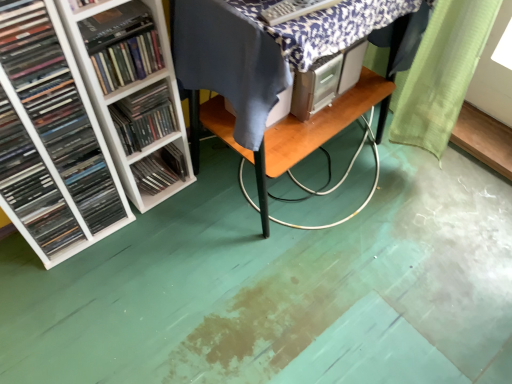
Image resolution: width=512 pixels, height=384 pixels. What are the coordinates of `white plastic shelf at left, positioned as the 2th shelf in back-to-front order` in the screenshot? It's located at [x=122, y=97].

At what (x,y) coordinates should I click in order to perform the action: click on hardcover book at left. Please return your answer as a coordinate pair (x, y). Looking at the image, I should click on (115, 25).

This screenshot has width=512, height=384. In order to click on white plastic shelf at left, marked as the second shelf in a front-to-back arrangement in this screenshot , I will do `click(142, 158)`.

Image resolution: width=512 pixels, height=384 pixels. Identify the location of wooden table at center. tap(296, 130).

What do you see at coordinates (296, 130) in the screenshot? The height and width of the screenshot is (384, 512). I see `wooden table at center` at bounding box center [296, 130].

What are the coordinates of `white plastic shelf at left, the third book when ordered from left to right` in the screenshot? It's located at (144, 117).

How distant is wooden table at center from white plastic shelf at left, positioned as the 2th shelf in back-to-front order?

wooden table at center and white plastic shelf at left, positioned as the 2th shelf in back-to-front order, are 14.89 inches apart.

From the image's perspective, is wooden table at center located above white plastic shelf at left, positioned as the 2th shelf in back-to-front order?

No, from the image's perspective, wooden table at center is not on top of white plastic shelf at left, positioned as the 2th shelf in back-to-front order.

From a real-world perspective, which is physically below, wooden table at center or white plastic shelf at left, the first shelf positioned from the front?

From a 3D spatial view, wooden table at center is below.

In terms of height, does wooden table at center look taller or shorter compared to white plastic shelf at left, the first shelf positioned from the front?

Clearly, wooden table at center is shorter compared to white plastic shelf at left, the first shelf positioned from the front.

How much distance is there between hardcover book at left and matte black books at left, which ranks as the 3th book in right-to-left order?

They are 15.42 inches apart.

Considering the relative positions of hardcover book at left and matte black books at left, positioned as the 1th book in left-to-right order, in the image provided, is hardcover book at left to the left of matte black books at left, positioned as the 1th book in left-to-right order, from the viewer's perspective?

No, hardcover book at left is not to the left of matte black books at left, positioned as the 1th book in left-to-right order.

Could matte black books at left, which ranks as the 3th book in right-to-left order, be considered to be inside hardcover book at left?

No, matte black books at left, which ranks as the 3th book in right-to-left order, is not inside hardcover book at left.

Based on the photo, is hardcover book at left turned away from matte black books at left, which ranks as the 3th book in right-to-left order?

That's not correct — hardcover book at left is not looking away from matte black books at left, which ranks as the 3th book in right-to-left order.

In terms of size, does white plastic shelf at left, marked as the second shelf in a front-to-back arrangement, appear bigger or smaller than white plastic shelf at left, marked as the 1th book in a right-to-left arrangement?

Clearly, white plastic shelf at left, marked as the second shelf in a front-to-back arrangement, is smaller in size than white plastic shelf at left, marked as the 1th book in a right-to-left arrangement.

From a real-world perspective, between white plastic shelf at left, marked as the second shelf in a front-to-back arrangement, and white plastic shelf at left, the third book when ordered from left to right, who is vertically higher?

white plastic shelf at left, the third book when ordered from left to right, from a real-world perspective.

Who is more distant, white plastic shelf at left, marked as the 1th shelf in a back-to-front arrangement, or white plastic shelf at left, marked as the 1th book in a right-to-left arrangement?

Positioned behind is white plastic shelf at left, marked as the 1th shelf in a back-to-front arrangement.

Measure the distance between wooden table at center and white plastic shelf at left, marked as the 1th shelf in a back-to-front arrangement.

A distance of 14.42 inches exists between wooden table at center and white plastic shelf at left, marked as the 1th shelf in a back-to-front arrangement.

From the image's perspective, between wooden table at center and white plastic shelf at left, marked as the second shelf in a front-to-back arrangement, who is located below?

white plastic shelf at left, marked as the second shelf in a front-to-back arrangement, appears lower in the image.

Would you say wooden table at center contains white plastic shelf at left, marked as the second shelf in a front-to-back arrangement?

Definitely not — white plastic shelf at left, marked as the second shelf in a front-to-back arrangement, is not inside wooden table at center.

Is wooden table at center beside white plastic shelf at left, marked as the second shelf in a front-to-back arrangement?

No.

Does white plastic shelves at left, which is counted as the second book, starting from the left, appear on the right side of white plastic shelf at left, the first shelf positioned from the front?

No.

From the image's perspective, would you say white plastic shelves at left, which is counted as the second book, starting from the left, is positioned over white plastic shelf at left, positioned as the 2th shelf in back-to-front order?

No.

Can you confirm if white plastic shelves at left, which is counted as the second book, starting from the left, is wider than white plastic shelf at left, positioned as the 2th shelf in back-to-front order?

Yes, white plastic shelves at left, which is counted as the second book, starting from the left, is wider than white plastic shelf at left, positioned as the 2th shelf in back-to-front order.

From the picture: Looking at their sizes, would you say white plastic shelf at left, marked as the 1th shelf in a back-to-front arrangement, is wider or thinner than matte black books at left, positioned as the 1th book in left-to-right order?

In the image, white plastic shelf at left, marked as the 1th shelf in a back-to-front arrangement, appears to be more narrow than matte black books at left, positioned as the 1th book in left-to-right order.

Locate an element on the screen. Image resolution: width=512 pixels, height=384 pixels. the 1st shelf counting from the right of the matte black books at left, positioned as the 1th book in left-to-right order is located at coordinates (142, 158).

From a real-world perspective, who is located higher, white plastic shelf at left, marked as the 1th shelf in a back-to-front arrangement, or matte black books at left, positioned as the 1th book in left-to-right order?

From a 3D spatial view, matte black books at left, positioned as the 1th book in left-to-right order, is above.

Which is closer, (134, 157) or (59, 243)?

The point (134, 157) is closer.

Between matte black books at left, which ranks as the 3th book in right-to-left order, and white plastic shelf at left, the first shelf positioned from the front, which one has smaller size?

matte black books at left, which ranks as the 3th book in right-to-left order.

Which book is the 1st one when counting from the front of the white plastic shelf at left, positioned as the 2th shelf in back-to-front order? Please provide its 2D coordinates.

[(32, 186)]

Which object is thinner, matte black books at left, positioned as the 1th book in left-to-right order, or white plastic shelf at left, the first shelf positioned from the front?

matte black books at left, positioned as the 1th book in left-to-right order, is thinner.

From the image's perspective, which one is positioned lower, matte black books at left, which ranks as the 3th book in right-to-left order, or white plastic shelf at left, the first shelf positioned from the front?

matte black books at left, which ranks as the 3th book in right-to-left order.

Find the location of a particular element. The width and height of the screenshot is (512, 384). shelf above the wooden table at center (from the image's perspective) is located at coordinates pyautogui.click(x=122, y=97).

Identify the location of the 2nd book to the left when counting from the hardcover book at left. (32, 186).

Estimate the real-world distances between objects in this image. Which object is closer to hardcover book at left, white plastic shelf at left, marked as the 1th book in a right-to-left arrangement, or matte black books at left, positioned as the 1th book in left-to-right order?

white plastic shelf at left, marked as the 1th book in a right-to-left arrangement, is positioned closer to the anchor hardcover book at left.

Looking at the image, which one is located further to hardcover book at left, white plastic shelf at left, marked as the 1th shelf in a back-to-front arrangement, or white plastic shelf at left, positioned as the 2th shelf in back-to-front order?

Among the two, white plastic shelf at left, marked as the 1th shelf in a back-to-front arrangement, is located further to hardcover book at left.

When comparing their distances from matte black books at left, positioned as the 1th book in left-to-right order, does white plastic shelves at left, which is counted as the second book, starting from the left, or white plastic shelf at left, positioned as the 2th shelf in back-to-front order, seem further?

Among the two, white plastic shelf at left, positioned as the 2th shelf in back-to-front order, is located further to matte black books at left, positioned as the 1th book in left-to-right order.

Which object lies nearer to the anchor point white plastic shelves at left, which is the 2th book in right-to-left order, wooden table at center or white plastic shelf at left, the first shelf positioned from the front?

white plastic shelf at left, the first shelf positioned from the front, is closer to white plastic shelves at left, which is the 2th book in right-to-left order.

Estimate the real-world distances between objects in this image. Which object is closer to matte black books at left, positioned as the 1th book in left-to-right order, wooden table at center or white plastic shelf at left, marked as the second shelf in a front-to-back arrangement?

Among the two, white plastic shelf at left, marked as the second shelf in a front-to-back arrangement, is located nearer to matte black books at left, positioned as the 1th book in left-to-right order.

Based on their spatial positions, is hardcover book at left or white plastic shelf at left, the third book when ordered from left to right, closer to white plastic shelf at left, the first shelf positioned from the front?

white plastic shelf at left, the third book when ordered from left to right, is positioned closer to the anchor white plastic shelf at left, the first shelf positioned from the front.

Considering their positions, is white plastic shelf at left, marked as the 1th book in a right-to-left arrangement, positioned further to white plastic shelf at left, the first shelf positioned from the front, than matte black books at left, positioned as the 1th book in left-to-right order?

matte black books at left, positioned as the 1th book in left-to-right order, lies further to white plastic shelf at left, the first shelf positioned from the front, than the other object.

When comparing their distances from white plastic shelves at left, which is the 2th book in right-to-left order, does wooden table at center or matte black books at left, positioned as the 1th book in left-to-right order, seem further?

wooden table at center.

I want to click on paperback book between matte black books at left, positioned as the 1th book in left-to-right order, and white plastic shelf at left, marked as the second shelf in a front-to-back arrangement, along the z-axis, so click(x=115, y=25).

Locate an element on the screen. The height and width of the screenshot is (384, 512). paperback book located between white plastic shelves at left, which is counted as the second book, starting from the left, and wooden table at center in the left-right direction is located at coordinates (115, 25).

Locate an element on the screen. The image size is (512, 384). shelf that lies between hardcover book at left and white plastic shelves at left, which is the 2th book in right-to-left order, from top to bottom is located at coordinates (122, 97).

I want to click on paperback book between white plastic shelves at left, which is the 2th book in right-to-left order, and white plastic shelf at left, marked as the 1th shelf in a back-to-front arrangement, in the front-back direction, so click(x=115, y=25).